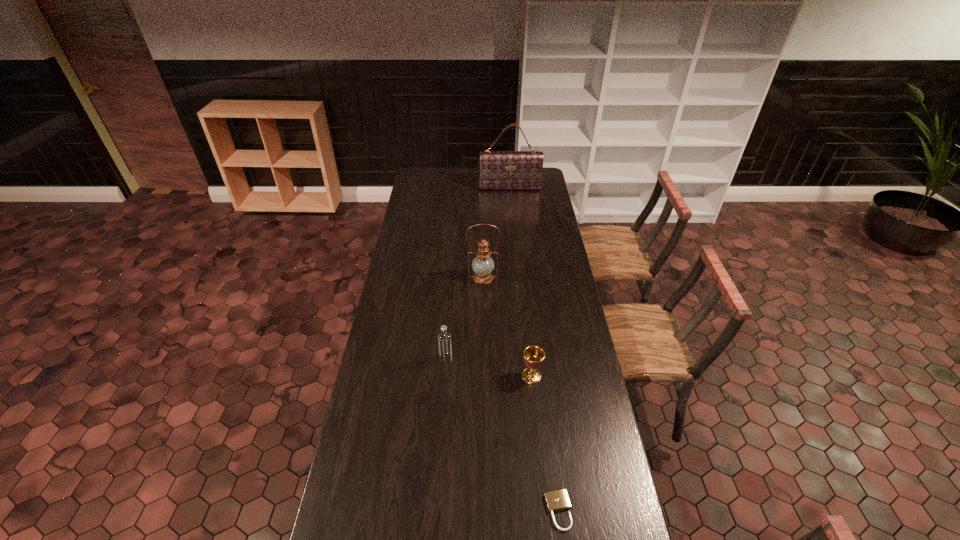
I want to click on free space located on the front of the farthest object with the clasp, so click(x=514, y=230).

You are a GUI agent. You are given a task and a screenshot of the screen. Output one action in this format:
    pyautogui.click(x=<x>, y=<y>)
    Task: Click on the vacant region located on the right of the second farthest object
    This screenshot has width=960, height=540.
    Given the screenshot: What is the action you would take?
    pyautogui.click(x=534, y=277)

Where is `vacant space located 0.100m on the front label of the third farthest object`? This screenshot has width=960, height=540. vacant space located 0.100m on the front label of the third farthest object is located at coordinates (479, 359).

Find the location of a particular element. The image size is (960, 540). vacant space located 0.340m on the back of the second nearest object is located at coordinates (524, 304).

Where is `blank space located on the left of the padlock`? The image size is (960, 540). blank space located on the left of the padlock is located at coordinates 443,511.

Where is `object that is at the far edge`? object that is at the far edge is located at coordinates (498, 170).

Locate an element on the screen. The height and width of the screenshot is (540, 960). handbag at the right edge is located at coordinates (498, 170).

I want to click on padlock that is at the right edge, so click(x=557, y=500).

Find the location of a particular element. Image resolution: width=960 pixels, height=540 pixels. object that is at the far right corner is located at coordinates (498, 170).

In the image, there is a desktop. Identify the location of vacant area at the far edge. This screenshot has width=960, height=540. (450, 178).